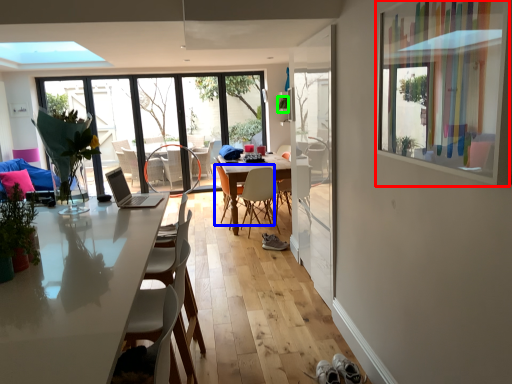
Question: Which is nearer to the window screen (highlighted by a red box)? chair (highlighted by a blue box) or plant (highlighted by a green box).

Choices:
 (A) chair
 (B) plant

Answer: (A)